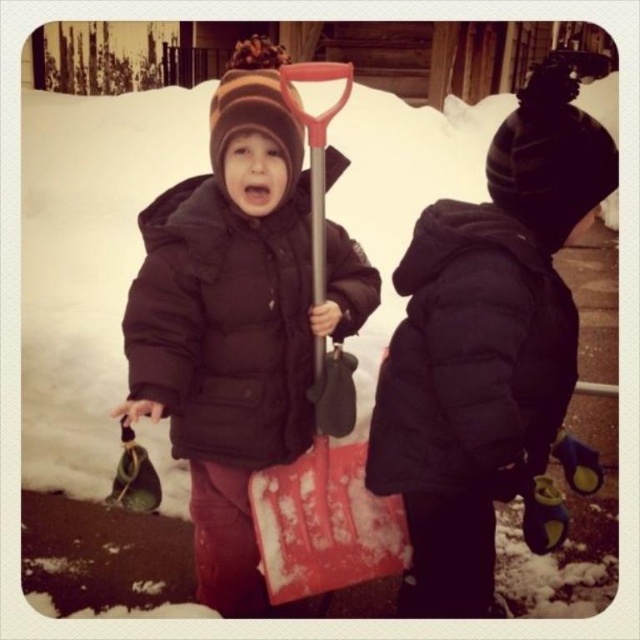
You are a photographer trying to capture both children in a single photo. Given that the black matte jacket at center is shorter than the matte black jacket at center, which child should you position closer to the camera to ensure both are fully visible in the frame?

To ensure both children are fully visible in the frame, position the child wearing the black matte jacket at center closer to the camera since it is shorter than the matte black jacket at center. This way, the taller child with the matte black jacket at center can be seen behind without being blocked by the shorter one.

You are a fashion designer observing two children in a winter scene. You notice both are wearing jackets labeled as black matte jacket at center and matte black jacket at center. Which jacket is smaller in size?

The black matte jacket at center is smaller in size compared to the matte black jacket at center.